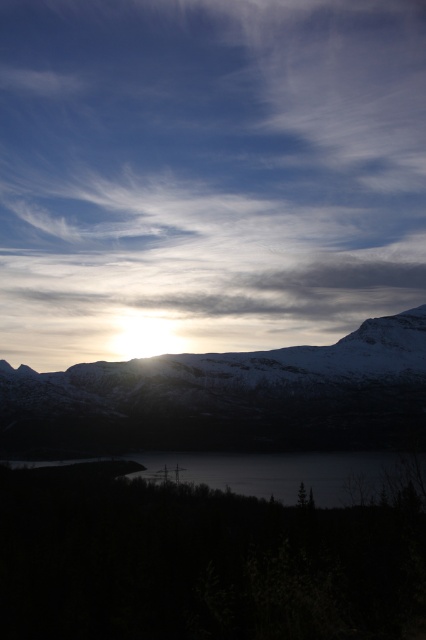
Question: Can you confirm if snowy rock mountain range at center is positioned to the left of dark glassy water at center?

Choices:
 (A) no
 (B) yes

Answer: (A)

Question: Which of the following is the farthest from the observer?

Choices:
 (A) dark glassy water at center
 (B) snowy rock mountain range at center
 (C) white fluffy cloud at upper center

Answer: (C)

Question: Does snowy rock mountain range at center appear under dark glassy water at center?

Choices:
 (A) no
 (B) yes

Answer: (A)

Question: Based on their relative distances, which object is farther from the dark glassy water at center?

Choices:
 (A) white fluffy cloud at upper center
 (B) snowy rock mountain range at center

Answer: (A)

Question: Among these points, which one is farthest from the camera?

Choices:
 (A) (288, 156)
 (B) (123, 381)

Answer: (A)

Question: Does snowy rock mountain range at center have a lesser width compared to dark glassy water at center?

Choices:
 (A) yes
 (B) no

Answer: (B)